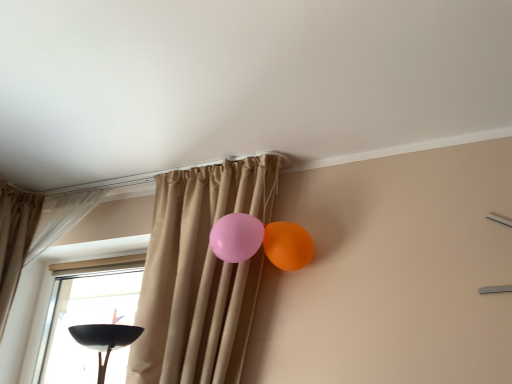
Question: Does beige fabric curtain at center, acting as the 1th curtain starting from the right, appear on the left side of beige fabric curtain at upper left, which appears as the 2th curtain when viewed from the right?

Choices:
 (A) no
 (B) yes

Answer: (A)

Question: Is the depth of beige fabric curtain at center, marked as the second curtain in a left-to-right arrangement, greater than that of beige fabric curtain at upper left, the 1th curtain positioned from the left?

Choices:
 (A) no
 (B) yes

Answer: (A)

Question: Does beige fabric curtain at center, marked as the second curtain in a left-to-right arrangement, have a greater width compared to beige fabric curtain at upper left, which appears as the 2th curtain when viewed from the right?

Choices:
 (A) no
 (B) yes

Answer: (B)

Question: Is the depth of beige fabric curtain at center, marked as the second curtain in a left-to-right arrangement, less than that of beige fabric curtain at upper left, which appears as the 2th curtain when viewed from the right?

Choices:
 (A) yes
 (B) no

Answer: (A)

Question: From the image's perspective, is beige fabric curtain at center, acting as the 1th curtain starting from the right, on beige fabric curtain at upper left, the 1th curtain positioned from the left?

Choices:
 (A) no
 (B) yes

Answer: (A)

Question: Is beige fabric curtain at center, acting as the 1th curtain starting from the right, positioned with its back to beige fabric curtain at upper left, which appears as the 2th curtain when viewed from the right?

Choices:
 (A) no
 (B) yes

Answer: (A)

Question: Does orange glossy balloon at upper right touch beige fabric curtain at upper left, which appears as the 2th curtain when viewed from the right?

Choices:
 (A) no
 (B) yes

Answer: (A)

Question: Would you say orange glossy balloon at upper right is a long distance from beige fabric curtain at upper left, which appears as the 2th curtain when viewed from the right?

Choices:
 (A) yes
 (B) no

Answer: (A)

Question: From the image's perspective, is orange glossy balloon at upper right located above beige fabric curtain at upper left, which appears as the 2th curtain when viewed from the right?

Choices:
 (A) yes
 (B) no

Answer: (B)

Question: Is orange glossy balloon at upper right at the left side of beige fabric curtain at upper left, which appears as the 2th curtain when viewed from the right?

Choices:
 (A) no
 (B) yes

Answer: (A)

Question: From the image's perspective, is orange glossy balloon at upper right below beige fabric curtain at upper left, which appears as the 2th curtain when viewed from the right?

Choices:
 (A) yes
 (B) no

Answer: (A)

Question: Considering the relative sizes of orange glossy balloon at upper right and beige fabric curtain at upper left, the 1th curtain positioned from the left, in the image provided, is orange glossy balloon at upper right smaller than beige fabric curtain at upper left, the 1th curtain positioned from the left,?

Choices:
 (A) yes
 (B) no

Answer: (A)

Question: Considering the relative sizes of beige fabric curtain at upper left, the 1th curtain positioned from the left, and beige fabric curtain at center, acting as the 1th curtain starting from the right, in the image provided, is beige fabric curtain at upper left, the 1th curtain positioned from the left, smaller than beige fabric curtain at center, acting as the 1th curtain starting from the right,?

Choices:
 (A) no
 (B) yes

Answer: (B)